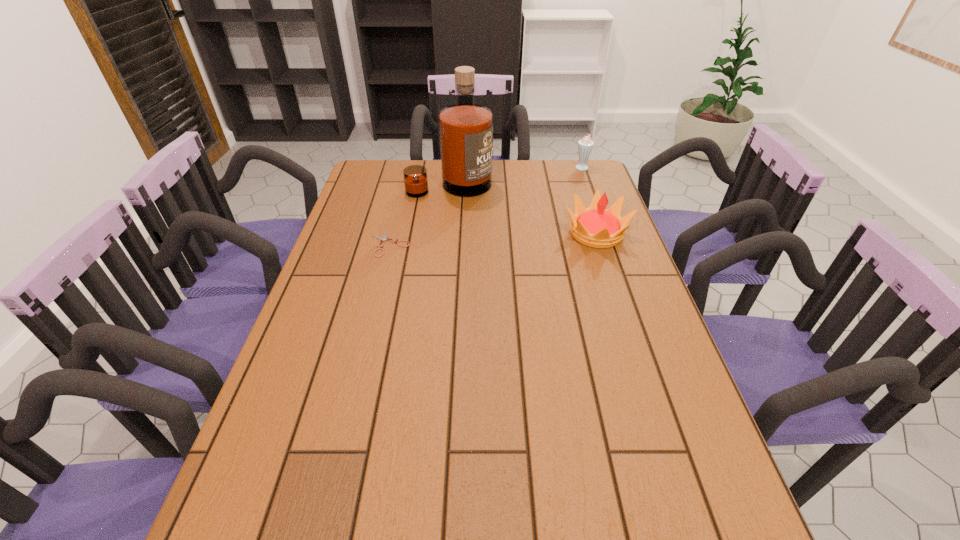
At what (x,y) coordinates should I click in order to perform the action: click on shears. Please return your answer as a coordinate pair (x, y). The width and height of the screenshot is (960, 540). Looking at the image, I should click on (384, 238).

Identify the location of crown. The width and height of the screenshot is (960, 540). (596, 227).

What are the coordinates of `liquor` in the screenshot? It's located at (465, 129).

Locate an element on the screen. the tallest object is located at coordinates (465, 129).

At what (x,y) coordinates should I click in order to perform the action: click on milkshake. Please return your answer as a coordinate pair (x, y). The image size is (960, 540). Looking at the image, I should click on (585, 145).

Locate an element on the screen. vacant area situated 0.190m on the right of the shortest object is located at coordinates (470, 244).

The height and width of the screenshot is (540, 960). Find the location of `vacant point located on the left of the crown`. vacant point located on the left of the crown is located at coordinates (461, 233).

Image resolution: width=960 pixels, height=540 pixels. I want to click on vacant space located on the front label of the liquor, so click(510, 258).

Locate an element on the screen. The image size is (960, 540). free space located on the front label of the liquor is located at coordinates (484, 222).

This screenshot has width=960, height=540. I want to click on vacant position located 0.230m on the front label of the liquor, so click(492, 232).